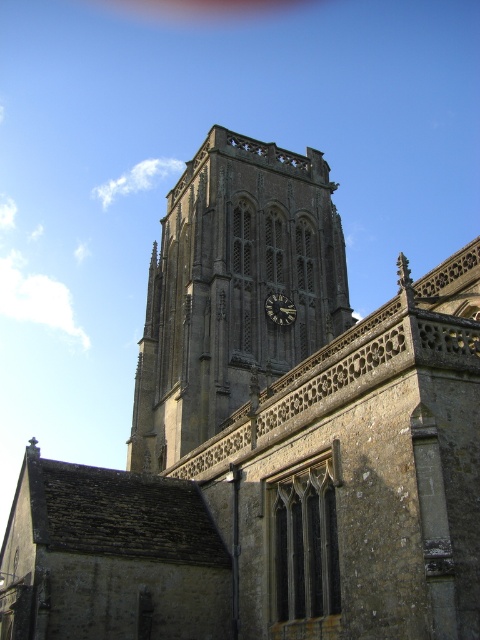
Is brown stone clock tower at center shorter than dark gray stone clock at center?

No, brown stone clock tower at center is not shorter than dark gray stone clock at center.

Is point (192, 445) farther from camera compared to point (287, 305)?

No.

Image resolution: width=480 pixels, height=640 pixels. What are the coordinates of `brown stone clock tower at center` in the screenshot? It's located at [x=233, y=289].